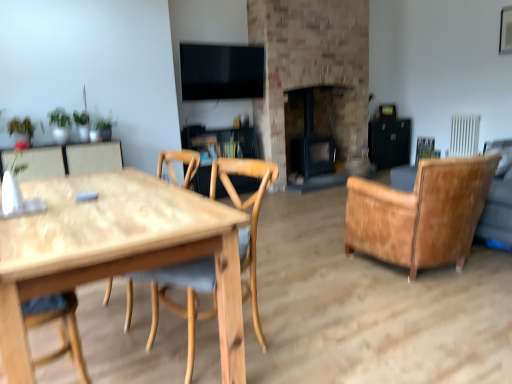
Question: From the image's perspective, is natural wood chair at center, which is the 1th chair in front-to-back order, located above or below brick fireplace at center, arranged as the 2th fireplace when viewed from the left?

Choices:
 (A) below
 (B) above

Answer: (A)

Question: Would you say natural wood chair at center, which is the 2th chair from back to front, is inside or outside brick fireplace at center, arranged as the first fireplace when viewed from the right?

Choices:
 (A) inside
 (B) outside

Answer: (B)

Question: Which of these objects is positioned closest to the black matte fireplace at center, which is the first fireplace from left to right?

Choices:
 (A) brick fireplace at center, arranged as the 2th fireplace when viewed from the left
 (B) leather armchair at right, the 1th chair viewed from the right
 (C) natural wood chair at center, positioned as the 2th chair in right-to-left order
 (D) natural wood table at left

Answer: (A)

Question: Which is nearer to the natural wood chair at center, which is the 1th chair in front-to-back order?

Choices:
 (A) leather armchair at right, the second chair in the front-to-back sequence
 (B) brick fireplace at center, arranged as the 2th fireplace when viewed from the left
 (C) natural wood table at left
 (D) black matte fireplace at center, which is the first fireplace from left to right

Answer: (C)